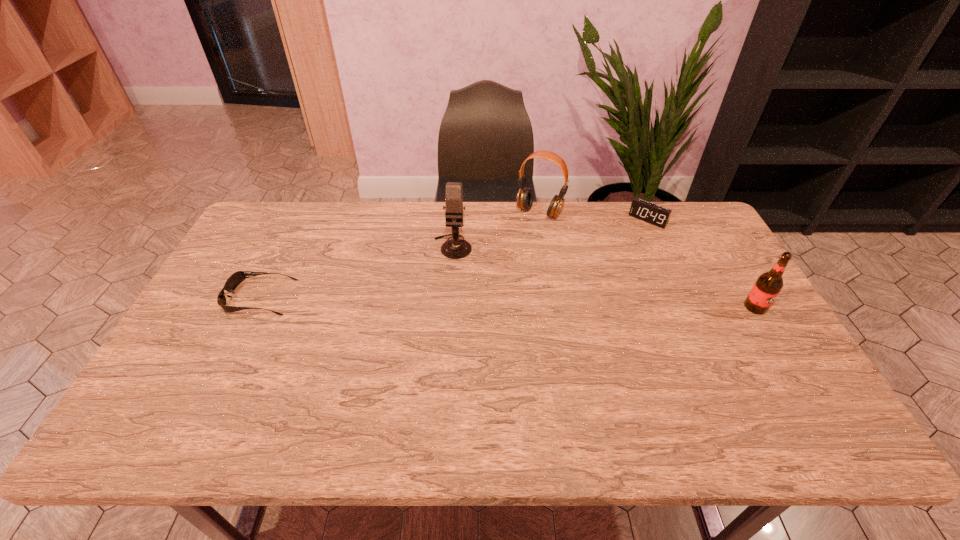
At what (x,y) coordinates should I click in order to perform the action: click on sunglasses. Please return your answer as a coordinate pair (x, y). Image resolution: width=960 pixels, height=540 pixels. Looking at the image, I should click on (234, 280).

You are a GUI agent. You are given a task and a screenshot of the screen. Output one action in this format:
    pyautogui.click(x=<x>, y=<y>)
    Task: Click on the shortest object
    The height and width of the screenshot is (540, 960).
    Given the screenshot: What is the action you would take?
    pyautogui.click(x=234, y=280)

Identify the location of the rightmost object. This screenshot has width=960, height=540. (768, 285).

Where is `the fourth object from right to left`? the fourth object from right to left is located at coordinates (455, 248).

You are a GUI agent. You are given a task and a screenshot of the screen. Output one action in this format:
    pyautogui.click(x=<x>, y=<y>)
    Task: Click on the third nearest object
    
    Given the screenshot: What is the action you would take?
    pyautogui.click(x=455, y=248)

Locate an element on the screen. the second shortest object is located at coordinates (651, 213).

Locate an element on the screen. The height and width of the screenshot is (540, 960). alarm clock is located at coordinates (651, 213).

Locate an element on the screen. the third object from right to left is located at coordinates (525, 196).

You are a GUI agent. You are given a task and a screenshot of the screen. Output one action in this format:
    pyautogui.click(x=<x>, y=<y>)
    Task: Click on the free space located 0.060m on the front-facing side of the shortest object
    This screenshot has height=540, width=960.
    Given the screenshot: What is the action you would take?
    [x=207, y=298]

Identify the location of vacant space located 0.050m on the front-facing side of the shortest object. click(210, 298).